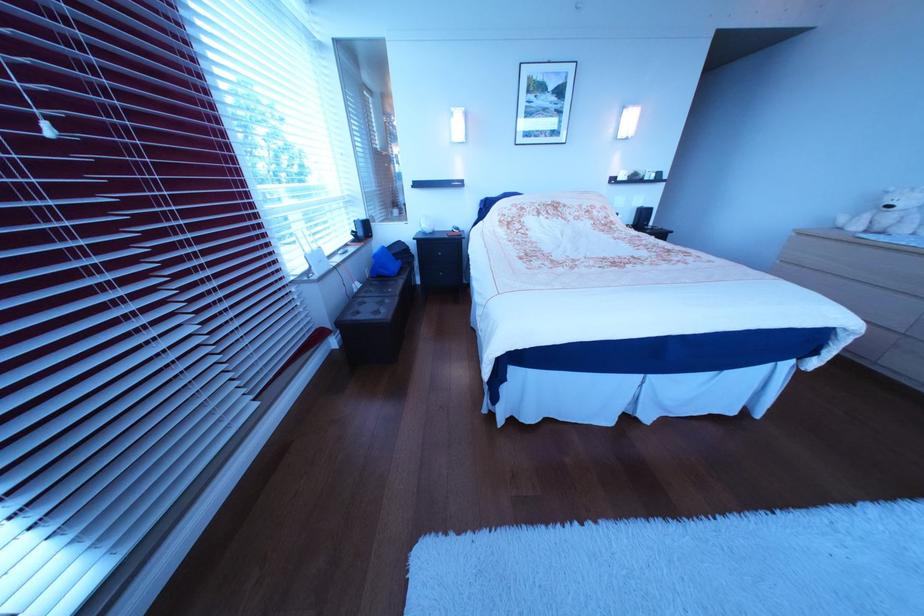
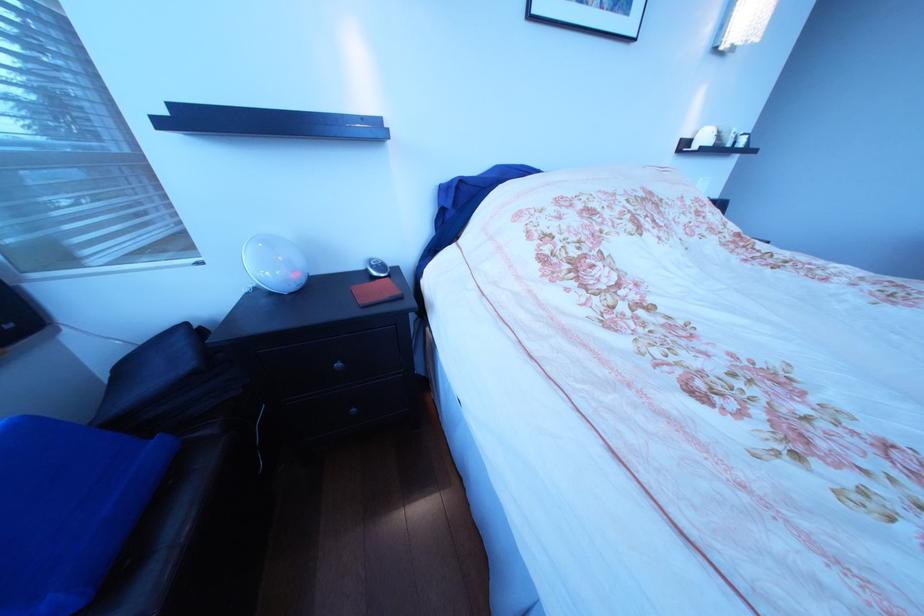
The point at (640,180) is marked in the first image. Where is the corresponding point in the second image?

(724, 146)